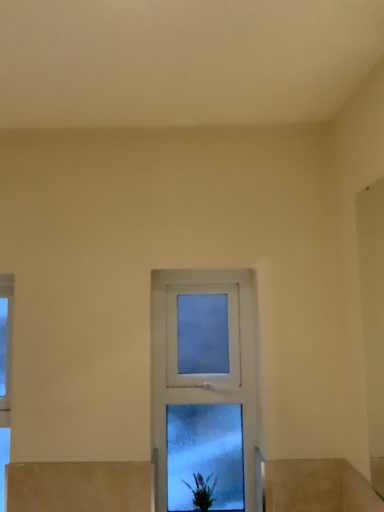
I want to click on green matte plant at lower center, so click(202, 492).

What do you see at coordinates (202, 492) in the screenshot? This screenshot has width=384, height=512. I see `green matte plant at lower center` at bounding box center [202, 492].

Image resolution: width=384 pixels, height=512 pixels. What do you see at coordinates (204, 389) in the screenshot?
I see `clear glass window at center` at bounding box center [204, 389].

Locate an element on the screen. This screenshot has width=384, height=512. clear glass window at center is located at coordinates (204, 389).

Locate an element on the screen. This screenshot has height=512, width=384. green matte plant at lower center is located at coordinates (202, 492).

Visually, is clear glass window at center positioned to the left or to the right of green matte plant at lower center?

clear glass window at center is to the right of green matte plant at lower center.

Which object is further away from the camera, clear glass window at center or green matte plant at lower center?

clear glass window at center is behind.

Is point (209, 424) less distant than point (194, 500)?

No, it is behind (194, 500).

From the image's perspective, would you say clear glass window at center is shown under green matte plant at lower center?

No, from the image's perspective, clear glass window at center is not below green matte plant at lower center.

From a real-world perspective, between clear glass window at center and green matte plant at lower center, who is vertically higher?

clear glass window at center.

Considering the sizes of clear glass window at center and green matte plant at lower center in the image, is clear glass window at center wider or thinner than green matte plant at lower center?

clear glass window at center is thinner than green matte plant at lower center.

Considering the relative sizes of clear glass window at center and green matte plant at lower center in the image provided, is clear glass window at center taller than green matte plant at lower center?

Yes, clear glass window at center is taller than green matte plant at lower center.

Considering the sizes of objects clear glass window at center and green matte plant at lower center in the image provided, who is bigger, clear glass window at center or green matte plant at lower center?

clear glass window at center.

Is clear glass window at center completely or partially outside of green matte plant at lower center?

Indeed, clear glass window at center is completely outside green matte plant at lower center.

Does clear glass window at center touch green matte plant at lower center?

No.

Could you tell me if clear glass window at center is facing green matte plant at lower center?

Yes.

Locate an element on the screen. window to the right of green matte plant at lower center is located at coordinates (204, 389).

Considering the positions of objects green matte plant at lower center and clear glass window at center in the image provided, who is more to the right, green matte plant at lower center or clear glass window at center?

Positioned to the right is clear glass window at center.

Between green matte plant at lower center and clear glass window at center, which one is positioned in front?

green matte plant at lower center is more forward.

Considering the points (197, 473) and (183, 399), which point is behind, point (197, 473) or point (183, 399)?

The point (183, 399) is behind.

From the image's perspective, is green matte plant at lower center above or below clear glass window at center?

green matte plant at lower center is below clear glass window at center.

From a real-world perspective, is green matte plant at lower center physically located above or below clear glass window at center?

From a real-world perspective, green matte plant at lower center is physically below clear glass window at center.

Is green matte plant at lower center thinner than clear glass window at center?

Incorrect, the width of green matte plant at lower center is not less than that of clear glass window at center.

Does green matte plant at lower center have a greater height compared to clear glass window at center?

No.

Which of these two, green matte plant at lower center or clear glass window at center, is smaller?

Smaller between the two is green matte plant at lower center.

Do you think green matte plant at lower center is within clear glass window at center, or outside of it?

green matte plant at lower center is not inside clear glass window at center, it's outside.

Is there a large distance between green matte plant at lower center and clear glass window at center?

No, green matte plant at lower center is not far from clear glass window at center.

Is green matte plant at lower center positioned with its back to clear glass window at center?

Yes, green matte plant at lower center's orientation is away from clear glass window at center.

Image resolution: width=384 pixels, height=512 pixels. I want to click on houseplant that appears below the clear glass window at center (from a real-world perspective), so click(x=202, y=492).

Find the location of a particular element. The height and width of the screenshot is (512, 384). window above the green matte plant at lower center (from the image's perspective) is located at coordinates (204, 389).

I want to click on houseplant below the clear glass window at center (from a real-world perspective), so click(202, 492).